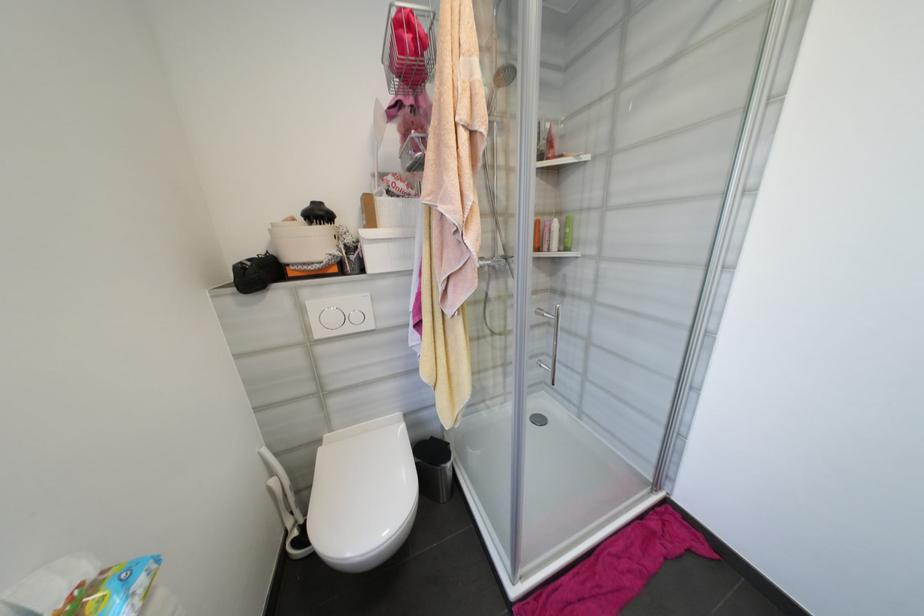
Locate an element on the screen. The width and height of the screenshot is (924, 616). shower control lever is located at coordinates (500, 123).